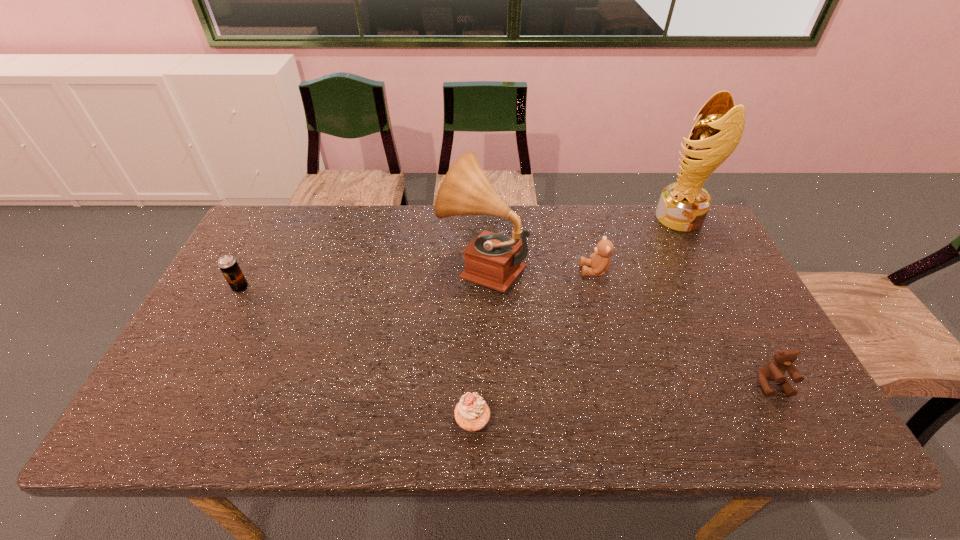
This screenshot has height=540, width=960. Identify the location of award. (683, 205).

You are a GUI agent. You are given a task and a screenshot of the screen. Output one action in this format:
    pyautogui.click(x=<x>, y=<y>)
    Task: Click on the tallest object
    
    Given the screenshot: What is the action you would take?
    pyautogui.click(x=683, y=205)

Image resolution: width=960 pixels, height=540 pixels. Identify the location of phonograph record. (x=492, y=260).

Where is `the left teddy bear`? the left teddy bear is located at coordinates (599, 261).

Image resolution: width=960 pixels, height=540 pixels. What are the coordinates of `the farther teddy bear` in the screenshot? It's located at (599, 261).

You are a GUI agent. You are given a task and a screenshot of the screen. Output one action in this format:
    pyautogui.click(x=<x>, y=<y>)
    Task: Click on the beer can
    The image size is (960, 540).
    Given the screenshot: What is the action you would take?
    pyautogui.click(x=228, y=265)

I want to click on the right teddy bear, so click(x=774, y=370).

What are the coordinates of `the fifth farthest object` in the screenshot? It's located at (774, 370).

Identify the location of the shortest object. (472, 413).

In order to click on cupcake in this screenshot , I will do `click(472, 413)`.